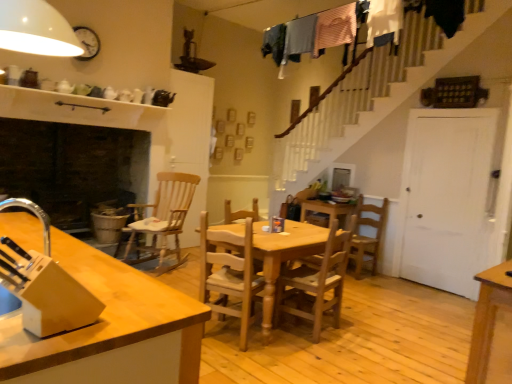
Question: Is light brown wooden chair at center, the 2th chair positioned from the left, taller or shorter than light brown wood at left?

Choices:
 (A) tall
 (B) short

Answer: (A)

Question: From the image's perspective, relative to light brown wood at left, is light brown wooden chair at center, which is counted as the 1th chair, starting from the front, above or below?

Choices:
 (A) below
 (B) above

Answer: (B)

Question: Which object is the closest to the wooden rocking chair at center-left, positioned as the third chair in front-to-back order?

Choices:
 (A) wooden chair at center, which is counted as the fourth chair, starting from the left
 (B) wooden chair at center, the second chair positioned from the front
 (C) wooden table at center
 (D) light brown wooden chair at center, the 2th chair positioned from the left
 (E) light brown wood at left

Answer: (C)

Question: Estimate the real-world distances between objects in this image. Which object is farther from the wooden table at center?

Choices:
 (A) wooden rocking chair at center-left, positioned as the third chair in front-to-back order
 (B) wooden chair at center, the first chair when ordered from back to front
 (C) light brown wooden chair at center, which is counted as the 1th chair, starting from the front
 (D) wooden chair at center, arranged as the 2th chair when viewed from the right
 (E) light brown wood at left

Answer: (A)